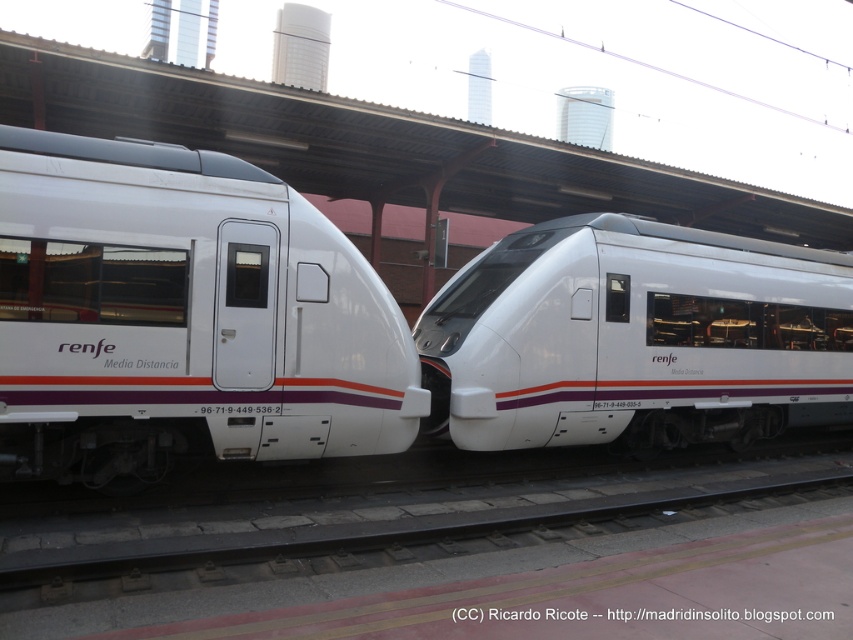
Based on the photo, does white glossy train at left have a lesser height compared to white glossy train at center?

Indeed, white glossy train at left has a lesser height compared to white glossy train at center.

This screenshot has height=640, width=853. Find the location of `white glossy train at left`. white glossy train at left is located at coordinates (183, 316).